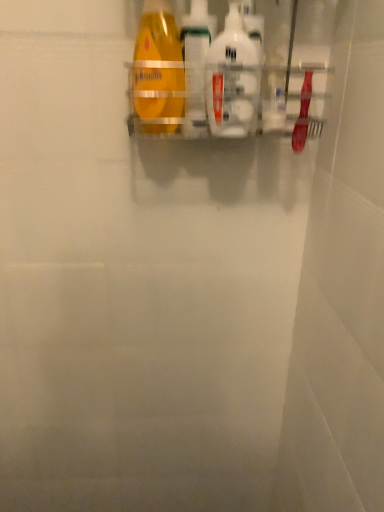
Question: Is translucent plastic bottle at center, the 1th cleaning product in the left-to-right sequence, at the left side of white glossy bottle at center, which appears as the 1th cleaning product when viewed from the right?

Choices:
 (A) no
 (B) yes

Answer: (B)

Question: From the image's perspective, is translucent plastic bottle at center, the 1th cleaning product in the left-to-right sequence, on top of white glossy bottle at center, the second cleaning product in the left-to-right sequence?

Choices:
 (A) no
 (B) yes

Answer: (B)

Question: From a real-world perspective, does translucent plastic bottle at center, the 1th cleaning product in the left-to-right sequence, stand above white glossy bottle at center, which appears as the 1th cleaning product when viewed from the right?

Choices:
 (A) yes
 (B) no

Answer: (A)

Question: Is translucent plastic bottle at center, which is the second cleaning product in right-to-left order, not close to white glossy bottle at center, the second cleaning product in the left-to-right sequence?

Choices:
 (A) no
 (B) yes

Answer: (A)

Question: Is translucent plastic bottle at center, the 1th cleaning product in the left-to-right sequence, outside of white glossy bottle at center, the second cleaning product in the left-to-right sequence?

Choices:
 (A) yes
 (B) no

Answer: (A)

Question: In terms of size, does white glossy bottle at center, the second cleaning product in the left-to-right sequence, appear bigger or smaller than yellow matte bottle at upper center?

Choices:
 (A) big
 (B) small

Answer: (B)

Question: Is point (253, 79) positioned closer to the camera than point (147, 56)?

Choices:
 (A) farther
 (B) closer

Answer: (A)

Question: Looking at their shapes, would you say white glossy bottle at center, which appears as the 1th cleaning product when viewed from the right, is wider or thinner than yellow matte bottle at upper center?

Choices:
 (A) wide
 (B) thin

Answer: (B)

Question: Considering the positions of white glossy bottle at center, which appears as the 1th cleaning product when viewed from the right, and yellow matte bottle at upper center in the image, is white glossy bottle at center, which appears as the 1th cleaning product when viewed from the right, taller or shorter than yellow matte bottle at upper center?

Choices:
 (A) short
 (B) tall

Answer: (A)

Question: Does point (147, 123) appear closer or farther from the camera than point (220, 60)?

Choices:
 (A) farther
 (B) closer

Answer: (A)

Question: From a real-world perspective, is yellow matte bottle at upper center above or below white glossy bottle at center, the second cleaning product in the left-to-right sequence?

Choices:
 (A) below
 (B) above

Answer: (B)

Question: Is yellow matte bottle at upper center taller or shorter than white glossy bottle at center, the second cleaning product in the left-to-right sequence?

Choices:
 (A) short
 (B) tall

Answer: (B)

Question: Is yellow matte bottle at upper center to the left or to the right of white glossy bottle at center, the second cleaning product in the left-to-right sequence, in the image?

Choices:
 (A) right
 (B) left

Answer: (B)

Question: Is translucent plastic bottle at center, the 1th cleaning product in the left-to-right sequence, to the left or to the right of yellow matte bottle at upper center in the image?

Choices:
 (A) left
 (B) right

Answer: (B)

Question: From their relative heights in the image, would you say translucent plastic bottle at center, which is the second cleaning product in right-to-left order, is taller or shorter than yellow matte bottle at upper center?

Choices:
 (A) tall
 (B) short

Answer: (B)